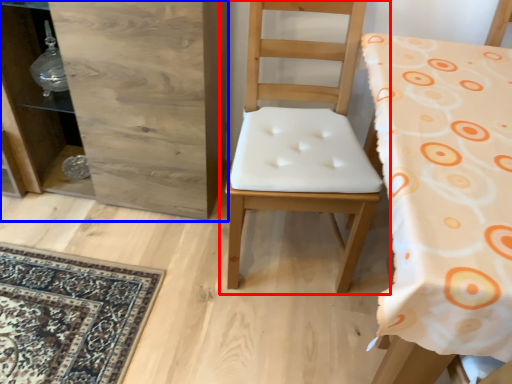
Question: Which object appears farthest to the camera in this image, chair (highlighted by a red box) or dresser (highlighted by a blue box)?

Choices:
 (A) chair
 (B) dresser

Answer: (B)